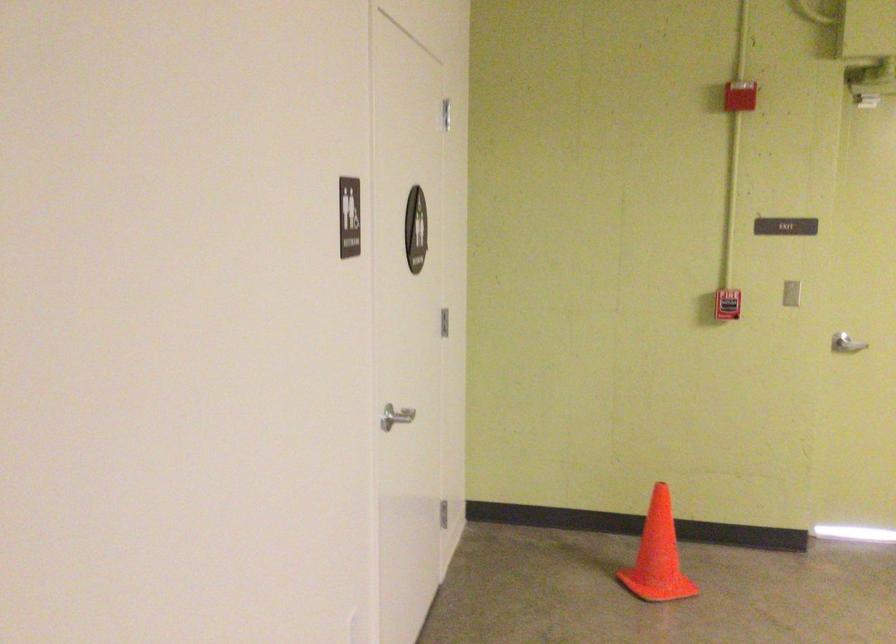
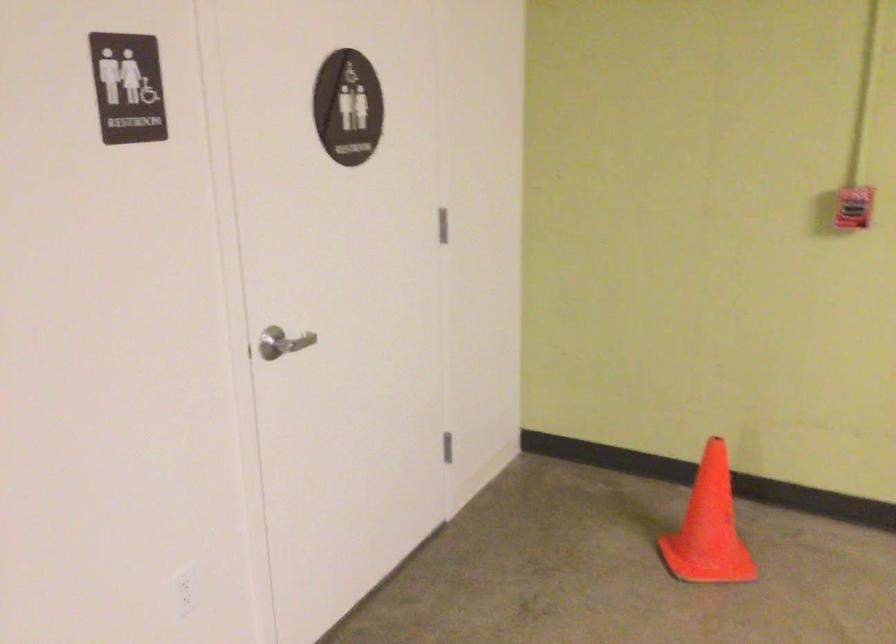
In the second image, find the point that corresponds to pixel 669 556 in the first image.

(709, 527)